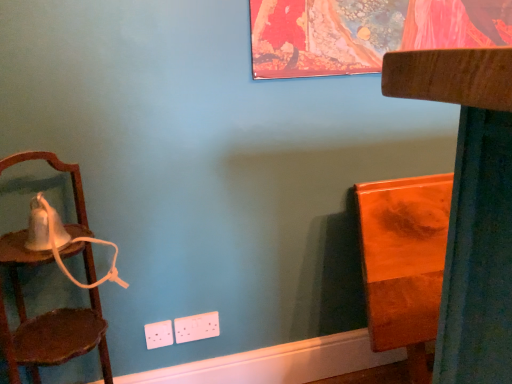
Question: Is wooden chair at right, the 2th furniture viewed from the back, at the back of orange glossy wood at right, placed as the second furniture when sorted from front to back?

Choices:
 (A) yes
 (B) no

Answer: (A)

Question: Does orange glossy wood at right, which is the 1th furniture in back-to-front order, appear on the right side of wooden chair at right, placed as the 1th furniture when sorted from front to back?

Choices:
 (A) no
 (B) yes

Answer: (B)

Question: Is orange glossy wood at right, placed as the second furniture when sorted from front to back, completely or partially outside of wooden chair at right, the 2th furniture viewed from the back?

Choices:
 (A) yes
 (B) no

Answer: (B)

Question: Is orange glossy wood at right, placed as the second furniture when sorted from front to back, smaller than wooden chair at right, the 2th furniture viewed from the back?

Choices:
 (A) no
 (B) yes

Answer: (B)

Question: Does orange glossy wood at right, which is the 1th furniture in back-to-front order, turn towards wooden chair at right, placed as the 1th furniture when sorted from front to back?

Choices:
 (A) yes
 (B) no

Answer: (A)

Question: Considering the relative sizes of orange glossy wood at right, which is the 1th furniture in back-to-front order, and wooden chair at right, placed as the 1th furniture when sorted from front to back, in the image provided, is orange glossy wood at right, which is the 1th furniture in back-to-front order, bigger than wooden chair at right, placed as the 1th furniture when sorted from front to back,?

Choices:
 (A) yes
 (B) no

Answer: (B)

Question: Can you confirm if wooden chair at left is taller than orange glossy wood at right, which is the 1th furniture in back-to-front order?

Choices:
 (A) yes
 (B) no

Answer: (B)

Question: From the image's perspective, is wooden chair at left located above orange glossy wood at right, placed as the second furniture when sorted from front to back?

Choices:
 (A) yes
 (B) no

Answer: (A)

Question: Does wooden chair at left come behind orange glossy wood at right, which is the 1th furniture in back-to-front order?

Choices:
 (A) yes
 (B) no

Answer: (B)

Question: Could you tell me if wooden chair at left is facing orange glossy wood at right, placed as the second furniture when sorted from front to back?

Choices:
 (A) yes
 (B) no

Answer: (A)

Question: From a real-world perspective, is wooden chair at left located higher than orange glossy wood at right, which is the 1th furniture in back-to-front order?

Choices:
 (A) no
 (B) yes

Answer: (B)

Question: Considering the relative sizes of wooden chair at left and orange glossy wood at right, placed as the second furniture when sorted from front to back, in the image provided, is wooden chair at left wider than orange glossy wood at right, placed as the second furniture when sorted from front to back,?

Choices:
 (A) no
 (B) yes

Answer: (B)

Question: Does wooden chair at right, placed as the 1th furniture when sorted from front to back, appear on the right side of orange glossy wood at right, placed as the second furniture when sorted from front to back?

Choices:
 (A) yes
 (B) no

Answer: (B)